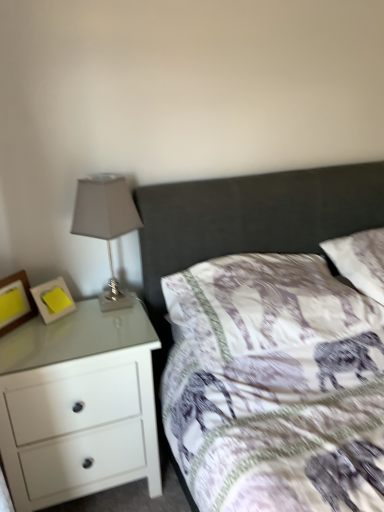
Where is `free space in front of matte gray glass table lamp at left`? free space in front of matte gray glass table lamp at left is located at coordinates (102, 337).